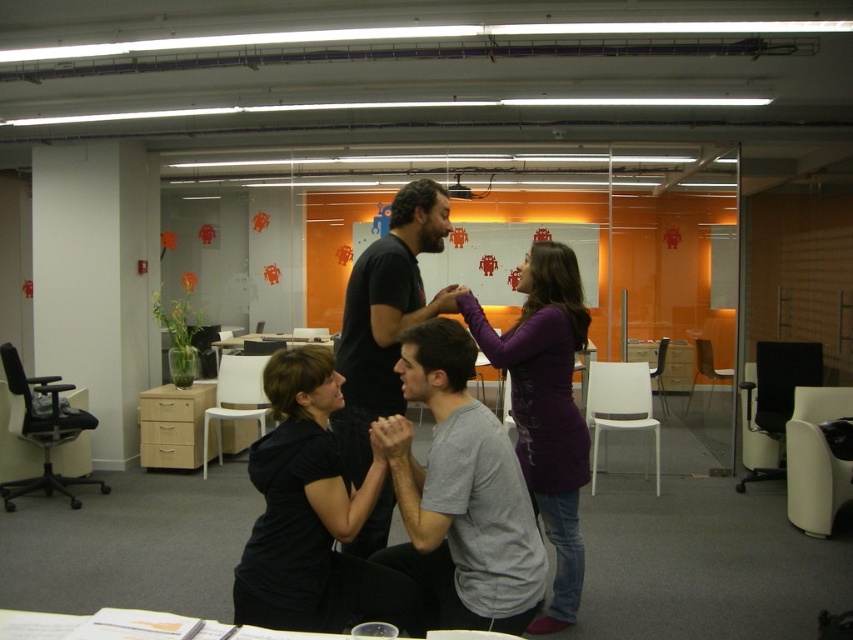
Consider the image. You are standing in the office and see the gray cotton shirt at center and the purple matte shirt at upper center. Which shirt is nearer to you?

The gray cotton shirt at center is closer to the viewer than the purple matte shirt at upper center.